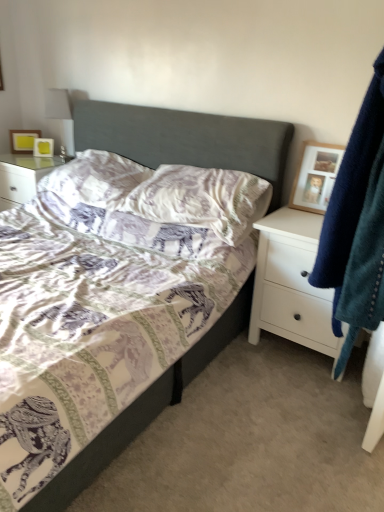
Question: Should I look upward or downward to see textured gray bed at center?

Choices:
 (A) up
 (B) down

Answer: (A)

Question: Considering the relative positions of printed fabric pillow at center, acting as the 2th pillow starting from the right, and matte yellow picture frame at upper left, positioned as the second picture frame in left-to-right order, in the image provided, is printed fabric pillow at center, acting as the 2th pillow starting from the right, behind matte yellow picture frame at upper left, positioned as the second picture frame in left-to-right order,?

Choices:
 (A) yes
 (B) no

Answer: (B)

Question: From the image's perspective, is printed fabric pillow at center, positioned as the 1th pillow in left-to-right order, beneath matte yellow picture frame at upper left, marked as the 2th picture frame in a bottom-to-top arrangement?

Choices:
 (A) yes
 (B) no

Answer: (A)

Question: Is printed fabric pillow at center, acting as the 2th pillow starting from the right, bigger than matte yellow picture frame at upper left, marked as the 2th picture frame in a top-to-bottom arrangement?

Choices:
 (A) no
 (B) yes

Answer: (B)

Question: Is printed fabric pillow at center, acting as the 2th pillow starting from the right, thinner than matte yellow picture frame at upper left, which is the second picture frame in right-to-left order?

Choices:
 (A) yes
 (B) no

Answer: (B)

Question: Is printed fabric pillow at center, positioned as the 1th pillow in left-to-right order, outside of matte yellow picture frame at upper left, marked as the 2th picture frame in a bottom-to-top arrangement?

Choices:
 (A) no
 (B) yes

Answer: (B)

Question: Is printed fabric pillow at center, acting as the 2th pillow starting from the right, directly adjacent to matte yellow picture frame at upper left, which appears as the 2th picture frame when viewed from the front?

Choices:
 (A) no
 (B) yes

Answer: (A)

Question: Can you confirm if wooden picture frame at upper right, arranged as the third picture frame when viewed from the top, is smaller than printed fabric pillow at center, positioned as the 1th pillow in left-to-right order?

Choices:
 (A) no
 (B) yes

Answer: (B)

Question: Is wooden picture frame at upper right, marked as the first picture frame in a bottom-to-top arrangement, next to printed fabric pillow at center, acting as the 2th pillow starting from the right?

Choices:
 (A) no
 (B) yes

Answer: (A)

Question: Can we say wooden picture frame at upper right, which is the third picture frame from left to right, lies outside printed fabric pillow at center, acting as the 2th pillow starting from the right?

Choices:
 (A) yes
 (B) no

Answer: (A)

Question: Is wooden picture frame at upper right, arranged as the third picture frame when viewed from the top, shorter than printed fabric pillow at center, positioned as the 1th pillow in left-to-right order?

Choices:
 (A) yes
 (B) no

Answer: (B)

Question: Does wooden picture frame at upper right, which is the 1th picture frame in front-to-back order, lie behind printed fabric pillow at center, positioned as the 1th pillow in left-to-right order?

Choices:
 (A) yes
 (B) no

Answer: (B)

Question: Is printed fabric pillow at center, positioned as the 1th pillow in left-to-right order, located within wooden picture frame at upper right, marked as the first picture frame in a bottom-to-top arrangement?

Choices:
 (A) no
 (B) yes

Answer: (A)

Question: Is the surface of matte yellow picture frame at upper left, the 3th picture frame viewed from the right, in direct contact with purple elephant-patterned pillow at center, the first pillow positioned from the right?

Choices:
 (A) no
 (B) yes

Answer: (A)